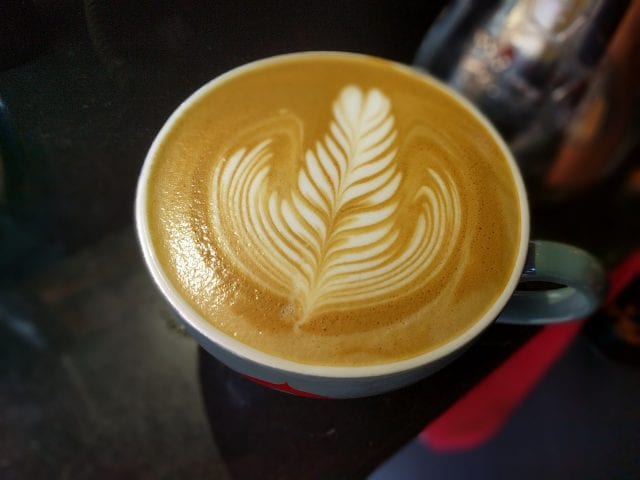
Where is `left side of table`? This screenshot has height=480, width=640. left side of table is located at coordinates (79, 347).